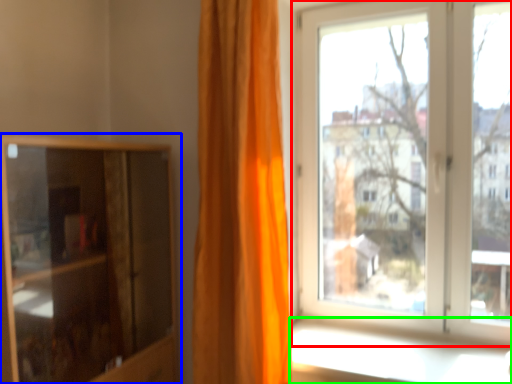
Question: Considering the real-world distances, which object is farthest from window (highlighted by a red box)? cupboard (highlighted by a blue box) or window sill (highlighted by a green box)?

Choices:
 (A) cupboard
 (B) window sill

Answer: (A)